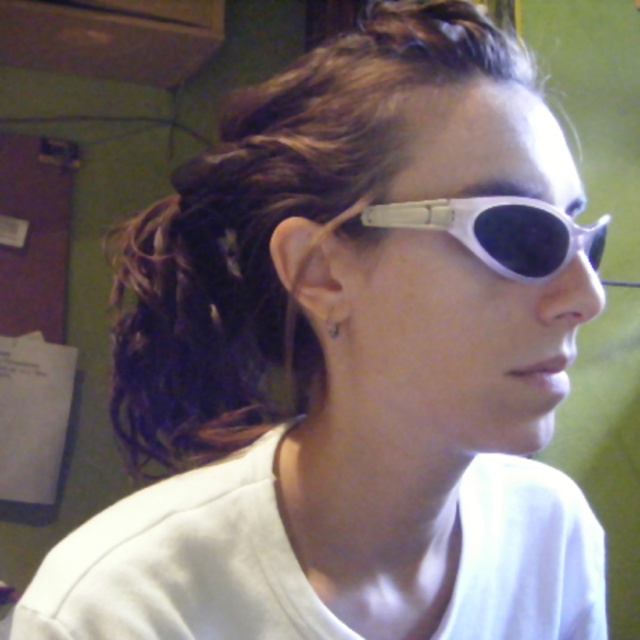
In the scene shown: You are standing in the room shown in the image and want to determine which of the two points, point (458, 205) or point (326, 332), is closer to you. Based on the description, which point is nearer?

Point (458, 205) is closer to the viewer than point (326, 332).